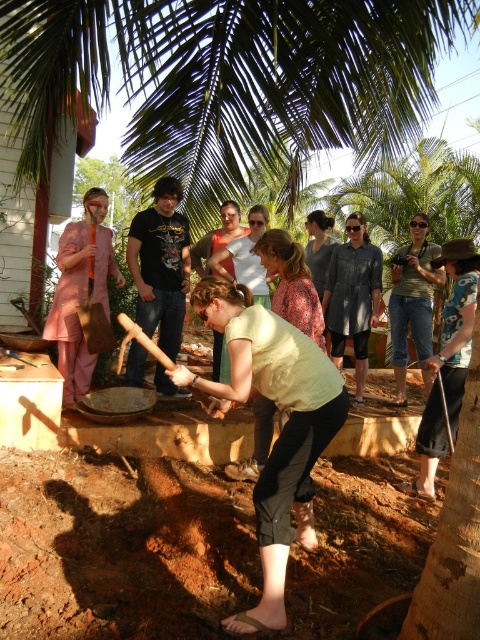
Question: Can you confirm if light yellow fabric shirt at center is positioned above light brown fabric shirt at center?

Choices:
 (A) yes
 (B) no

Answer: (B)

Question: Which point is farther from the camera taking this photo?

Choices:
 (A) [168, 259]
 (B) [256, 291]

Answer: (B)

Question: Considering the real-world distances, which object is closest to the denim shorts at center?

Choices:
 (A) green leafy palm tree at upper center
 (B) green fabric shirt at center

Answer: (B)

Question: Which of these objects is positioned closest to the orange wooden shovel at center?

Choices:
 (A) matte pink fabric at left
 (B) light brown hair at center
 (C) black t-shirt at center
 (D) green leafy palm tree at upper center

Answer: (A)

Question: Can you confirm if black t-shirt at center is positioned above light brown fabric shirt at center?

Choices:
 (A) no
 (B) yes

Answer: (A)

Question: Does black t-shirt at center have a smaller size compared to denim shorts at center?

Choices:
 (A) yes
 (B) no

Answer: (A)